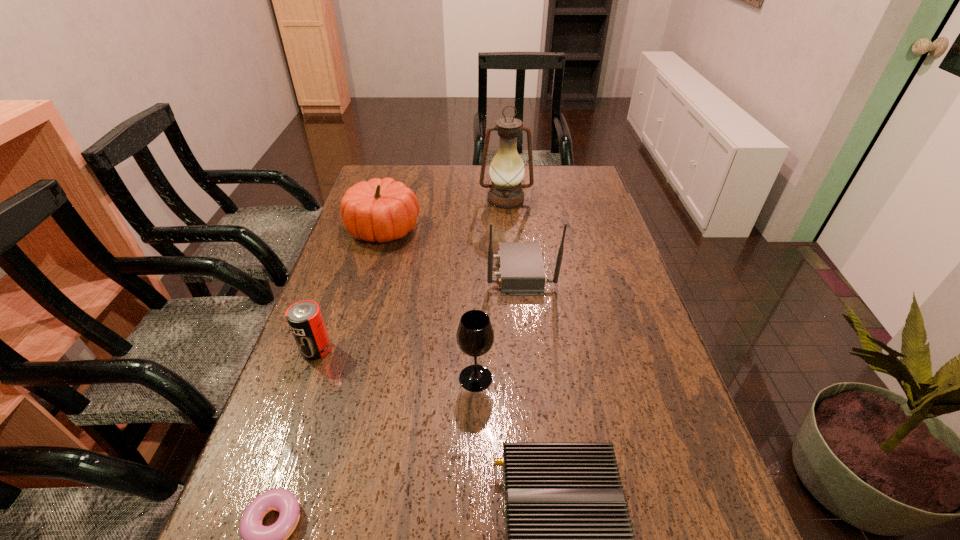
Image resolution: width=960 pixels, height=540 pixels. In order to click on blank space located 0.170m on the back of the taller router to connect cables in this screenshot , I will do `click(426, 272)`.

Where is `free space located 0.250m on the left of the fifth farthest object`? Image resolution: width=960 pixels, height=540 pixels. free space located 0.250m on the left of the fifth farthest object is located at coordinates click(x=345, y=378).

Locate an element on the screen. vacant space positioned 0.190m on the front of the pumpkin is located at coordinates (364, 295).

The image size is (960, 540). I want to click on free point located on the front of the can, so click(x=292, y=416).

This screenshot has width=960, height=540. What are the coordinates of `object that is at the far edge` in the screenshot? It's located at (507, 169).

The image size is (960, 540). Identify the location of pumpkin positioned at the left edge. (383, 210).

I want to click on can situated at the left edge, so click(304, 317).

In the image, there is a desktop. Where is `free region at the far edge`? free region at the far edge is located at coordinates [x=459, y=177].

Identify the location of free space at the left edge. The width and height of the screenshot is (960, 540). (324, 390).

In the image, there is a desktop. Identify the location of vacant space at the right edge. This screenshot has width=960, height=540. (629, 292).